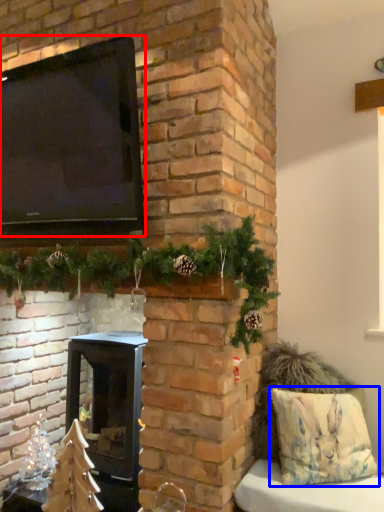
Question: Which point is further to the camera, window screen (highlighted by a red box) or pillow (highlighted by a blue box)?

Choices:
 (A) window screen
 (B) pillow

Answer: (B)